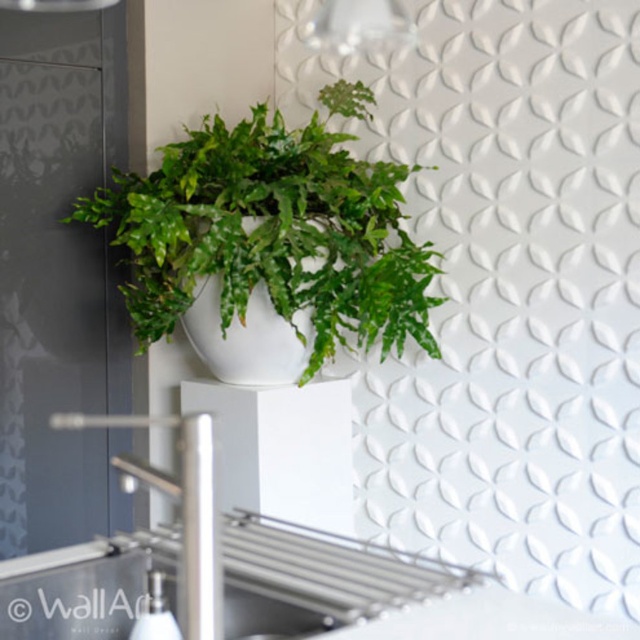
Does point (196, 230) lie behind point (218, 538)?

Yes, it is behind point (218, 538).

Between green matte plant at upper center and silver metallic faucet at center, which one has less height?

silver metallic faucet at center

Who is more distant from viewer, (225, 172) or (198, 636)?

The point (225, 172) is more distant.

Locate an element on the screen. The height and width of the screenshot is (640, 640). green matte plant at upper center is located at coordinates (273, 230).